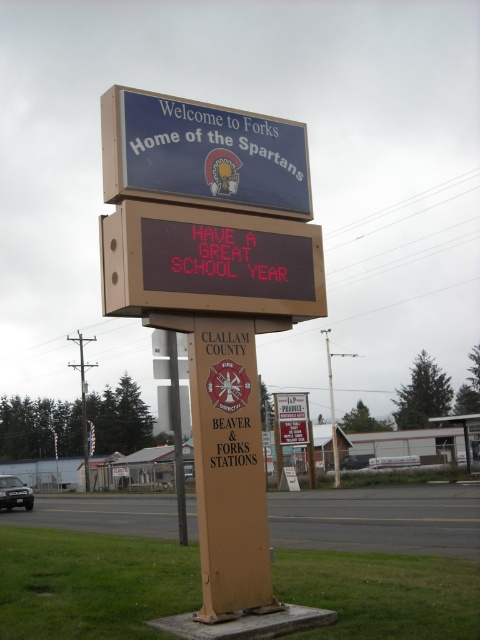
Question: Considering the real-world distances, which object is closest to the metallic pole at center?

Choices:
 (A) blue matte signboard at upper center
 (B) red led display at center

Answer: (B)

Question: Which object is closer to the camera taking this photo?

Choices:
 (A) metallic pole at center
 (B) red led display at center
 (C) blue matte signboard at upper center

Answer: (B)

Question: Which object is positioned closest to the red led display at center?

Choices:
 (A) metallic pole at center
 (B) blue matte signboard at upper center

Answer: (B)

Question: Does blue matte signboard at upper center have a lesser width compared to metallic pole at center?

Choices:
 (A) yes
 (B) no

Answer: (A)

Question: Does red led display at center appear on the right side of blue matte signboard at upper center?

Choices:
 (A) no
 (B) yes

Answer: (B)

Question: Is red led display at center below blue matte signboard at upper center?

Choices:
 (A) no
 (B) yes

Answer: (B)